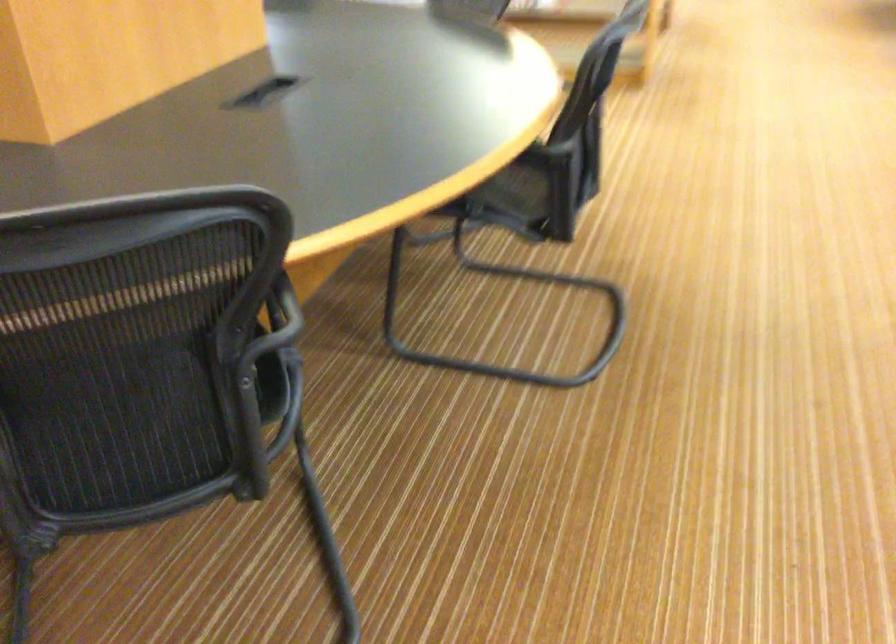
Where is `black chair armrest`? black chair armrest is located at coordinates (280, 325).